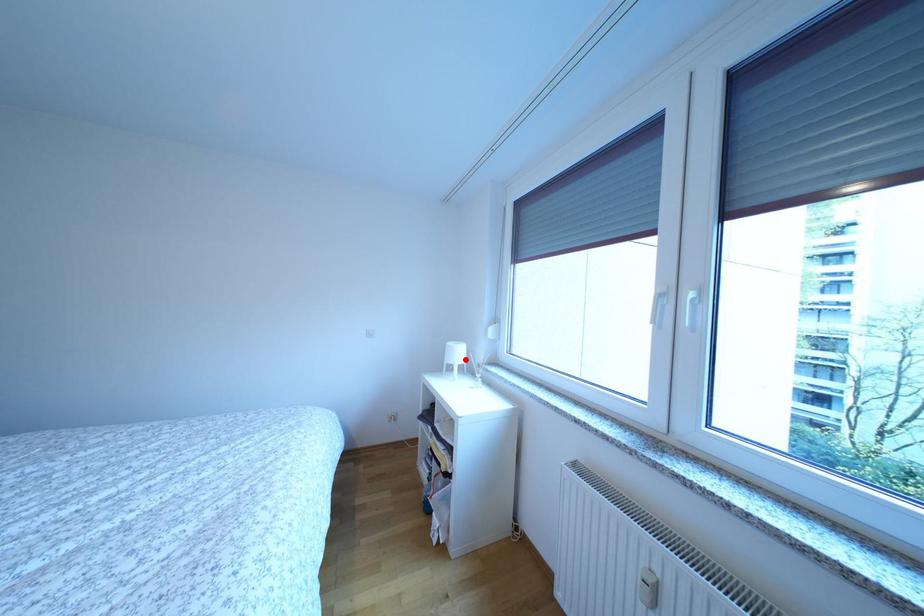
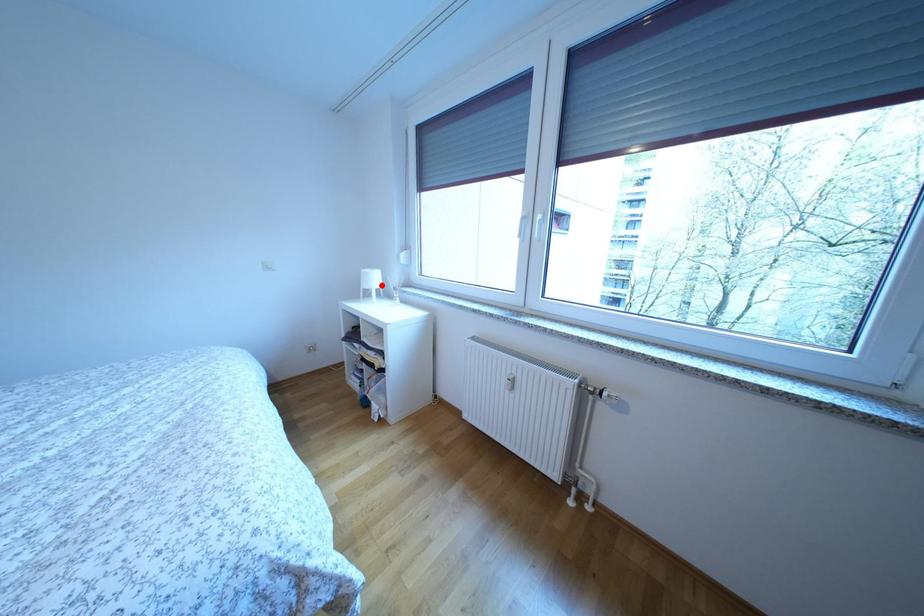
I am providing you with two images of the same scene from different viewpoints. A red point is marked on the first image and another point is marked on the second image. Do the highlighted points in image1 and image2 indicate the same real-world spot?

Yes